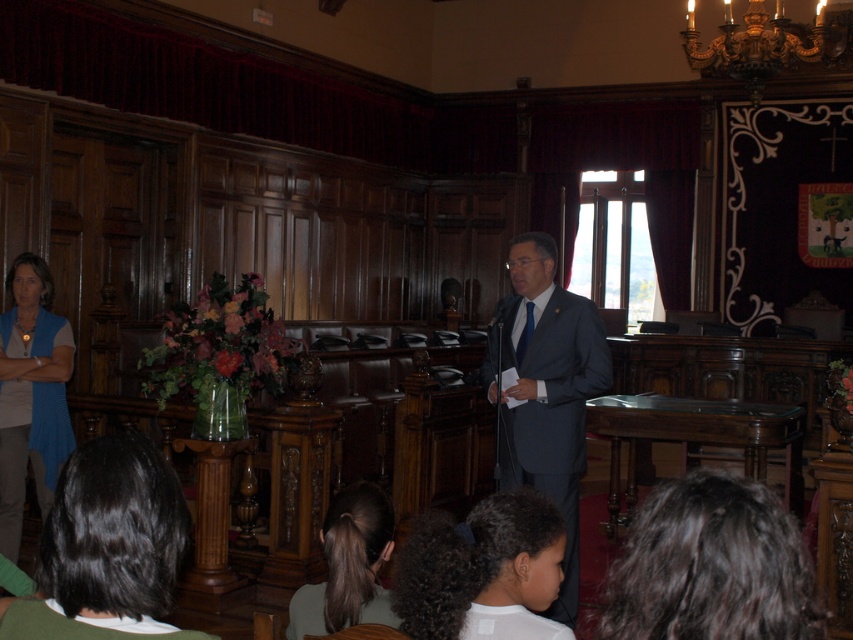
Does dark blue suit at center have a greater height compared to dark brown hair at lower center?

Yes, dark blue suit at center is taller than dark brown hair at lower center.

Between point (511, 259) and point (358, 540), which one is positioned in front?

Point (358, 540) is in front.

What do you see at coordinates (544, 390) in the screenshot? I see `dark blue suit at center` at bounding box center [544, 390].

Find the location of a particular element. The image size is (853, 640). dark blue suit at center is located at coordinates (544, 390).

Is dark blue suit at center below blue knitted vest at lower left?

Indeed, dark blue suit at center is positioned under blue knitted vest at lower left.

Who is higher up, dark blue suit at center or blue knitted vest at lower left?

blue knitted vest at lower left

The height and width of the screenshot is (640, 853). Identify the location of dark blue suit at center. click(x=544, y=390).

Find the location of a particular element. This screenshot has width=853, height=640. blue knitted vest at lower left is located at coordinates (30, 396).

Is blue knitted vest at lower left thinner than dark brown hair at lower center?

In fact, blue knitted vest at lower left might be wider than dark brown hair at lower center.

Which is in front, point (38, 404) or point (369, 488)?

Point (369, 488)

Find the location of a particular element. blue knitted vest at lower left is located at coordinates (30, 396).